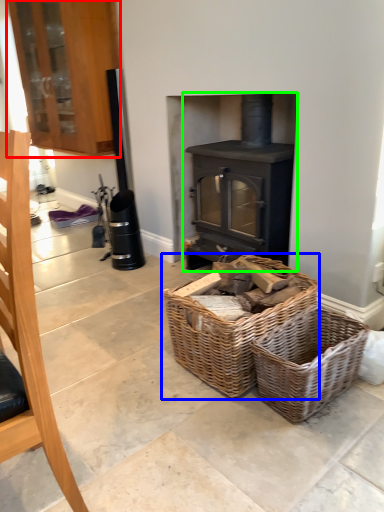
Question: Which object is positioned closest to cabinetry (highlighted by a red box)? Select from picnic basket (highlighted by a blue box) and wood burning stove (highlighted by a green box).

Choices:
 (A) picnic basket
 (B) wood burning stove

Answer: (B)